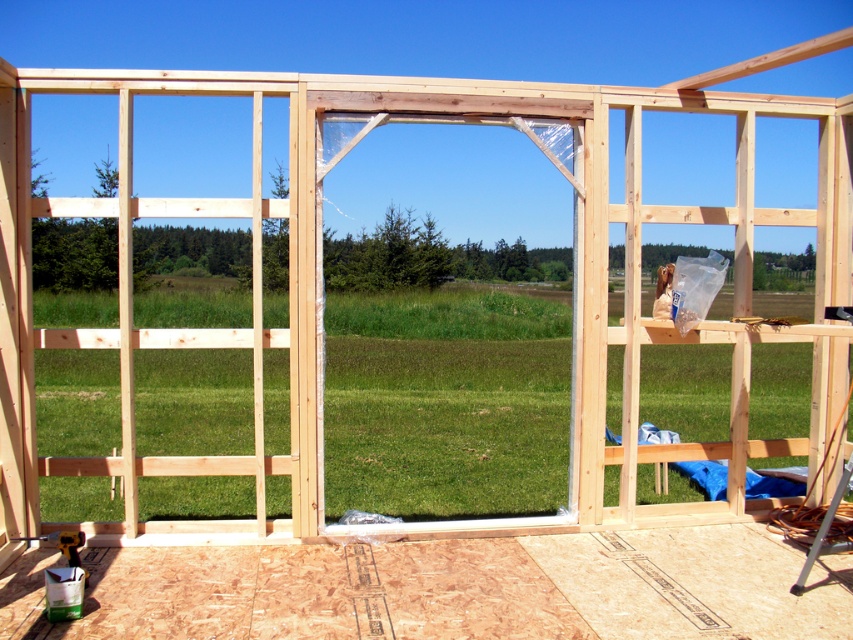
You are an inspector checking the construction site. You need to determine if the clear plastic window at center can be securely fastened to the frame using the same hardware as the natural wood screen door at center. Based on their thickness, what would you recommend?

The clear plastic window at center is thinner than the natural wood screen door at center, so the hardware designed for the natural wood screen door at center may not securely fasten the thinner clear plastic window at center. Consider using thinner or shorter screws or adjusting the hardware to accommodate the difference in thickness.

You are a contractor inspecting the construction site. You notice the clear plastic window at center and the natural wood screen door at center. Which object is positioned higher in the structure?

The clear plastic window at center is above the natural wood screen door at center, so it is positioned higher in the structure.